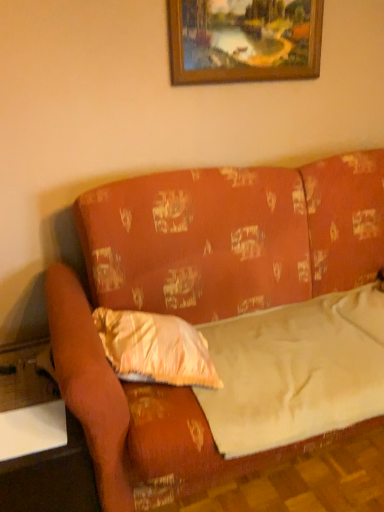
The height and width of the screenshot is (512, 384). What are the coordinates of `vacant space underneath wooden frame at upper center (from a real-world perspective)` in the screenshot? It's located at (249, 141).